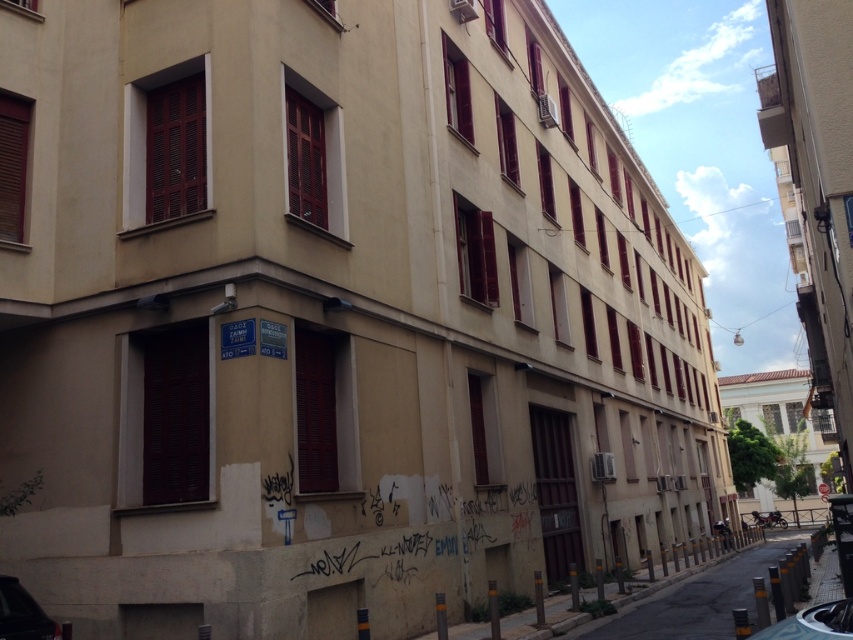
You are a pedestrian standing on the concrete sidewalk at lower right and want to cross the street. Is the silver metallic car at lower right blocking your path?

The silver metallic car at lower right is behind the concrete sidewalk at lower right, so it is not blocking your path as you stand on the sidewalk.

You are standing in front of the residential building and see a point marked at coordinates [24,614]. Based on the scene description, what object is this point located on?

The point at coordinates [24,614] is located on the shiny black car at lower left.